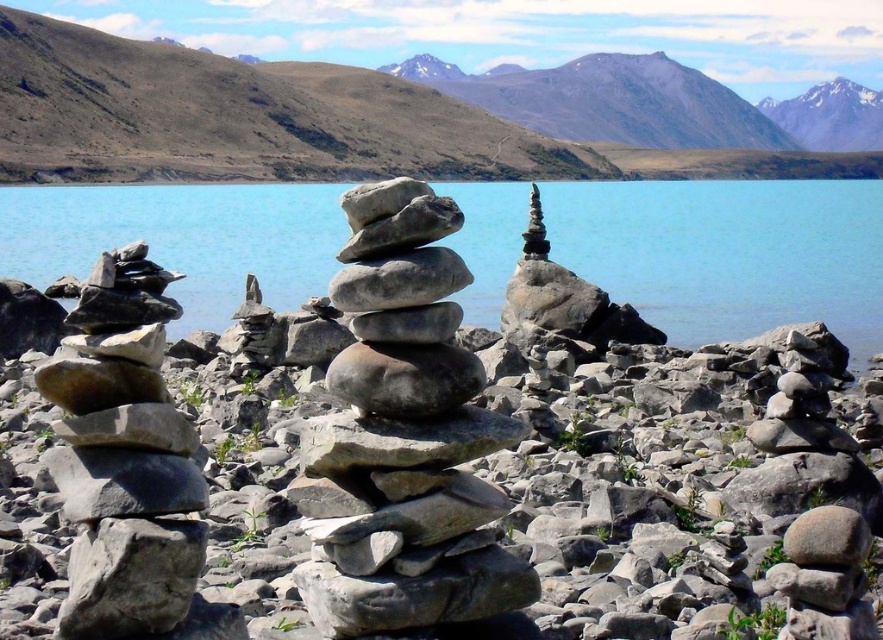
Who is shorter, blue smooth water at center or gray stone stack at center?

gray stone stack at center

Consider the image. Is blue smooth water at center wider than gray stone stack at center?

Yes, blue smooth water at center is wider than gray stone stack at center.

Between point (855, 349) and point (393, 508), which one is positioned behind?

The point (855, 349) is behind.

Where is `blue smooth water at center`? blue smooth water at center is located at coordinates (728, 253).

Between point (707, 189) and point (79, 451), which one is positioned in front?

Positioned in front is point (79, 451).

Where is `blue smooth water at center`? The height and width of the screenshot is (640, 883). blue smooth water at center is located at coordinates (728, 253).

Which is in front, point (510, 195) or point (398, 93)?

Point (510, 195) is in front.

Which of these two, blue smooth water at center or gray rock formation at center, stands taller?

Standing taller between the two is gray rock formation at center.

Who is more distant from viewer, (691,189) or (99,148)?

Point (691,189)

The height and width of the screenshot is (640, 883). I want to click on blue smooth water at center, so click(728, 253).